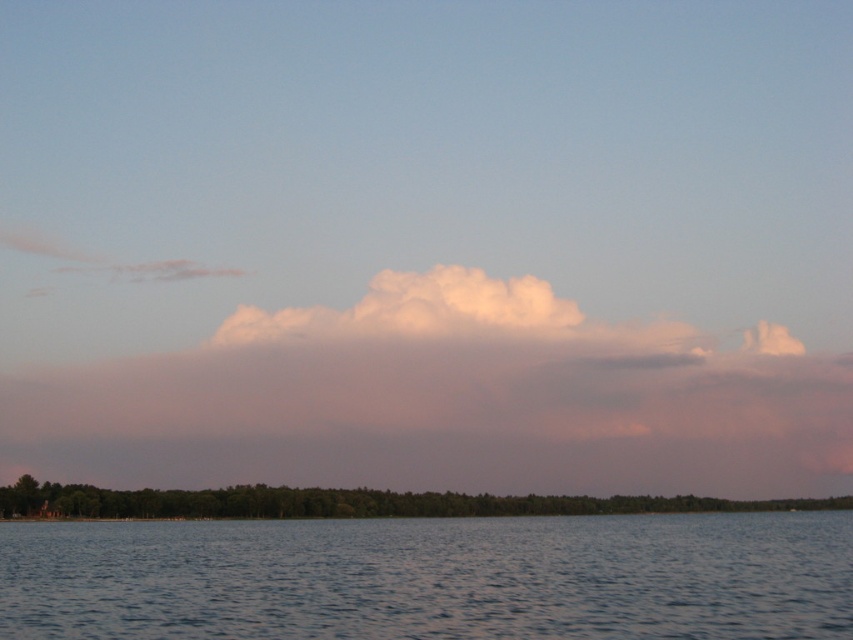
Based on the photo, can you confirm if clear water at lower center is smaller than green leafy trees at lower center?

Incorrect, clear water at lower center is not smaller in size than green leafy trees at lower center.

Between point (215, 634) and point (546, 500), which one is positioned behind?

Point (546, 500)

Which is in front, point (544, 580) or point (221, 500)?

Point (544, 580) is more forward.

Find the location of `clear water at lower center`. clear water at lower center is located at coordinates (432, 577).

Does white fluffy cloud at center lie in front of green leafy trees at lower center?

No, it is behind green leafy trees at lower center.

Is point (759, 374) farther from camera compared to point (352, 499)?

Yes, point (759, 374) is behind point (352, 499).

Which is in front, point (35, 433) or point (39, 506)?

Point (39, 506) is in front.

You are a GUI agent. You are given a task and a screenshot of the screen. Output one action in this format:
    pyautogui.click(x=<x>, y=<y>)
    Task: Click on the white fluffy cloud at center
    
    Given the screenshot: What is the action you would take?
    pyautogui.click(x=445, y=401)

The height and width of the screenshot is (640, 853). Describe the element at coordinates (445, 401) in the screenshot. I see `white fluffy cloud at center` at that location.

Does white fluffy cloud at center appear under clear water at lower center?

Yes.

Locate an element on the screen. white fluffy cloud at center is located at coordinates (445, 401).